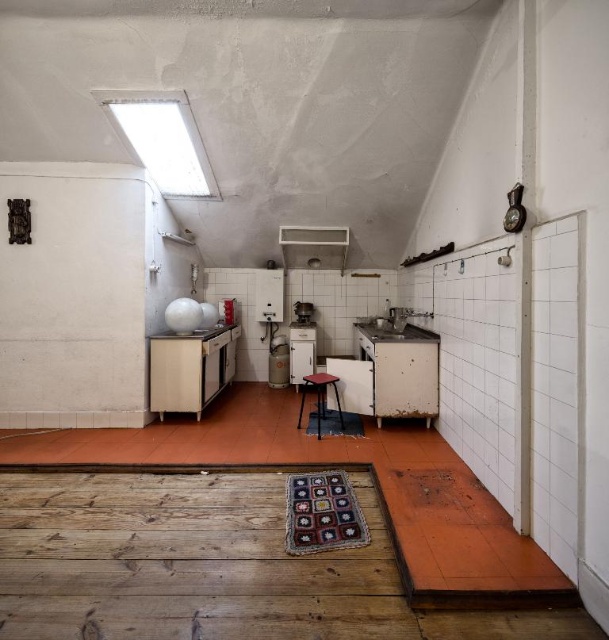
Question: Is white glossy refrigerator at center above wooden stool at center?

Choices:
 (A) yes
 (B) no

Answer: (A)

Question: Is knitted multicolored rug at center further to camera compared to white glossy refrigerator at center?

Choices:
 (A) yes
 (B) no

Answer: (B)

Question: Among these points, which one is farthest from the camera?

Choices:
 (A) [x=303, y=392]
 (B) [x=317, y=234]

Answer: (A)

Question: Does knitted multicolored rug at center lie in front of wooden stool at center?

Choices:
 (A) yes
 (B) no

Answer: (A)

Question: Which point is farther to the camera?

Choices:
 (A) (319, 416)
 (B) (301, 316)

Answer: (B)

Question: Considering the real-world distances, which object is farthest from the white glossy exhaust hood at upper center?

Choices:
 (A) white glossy refrigerator at center
 (B) wooden stool at center
 (C) metallic gray stove at center
 (D) crocheted rug at center

Answer: (D)